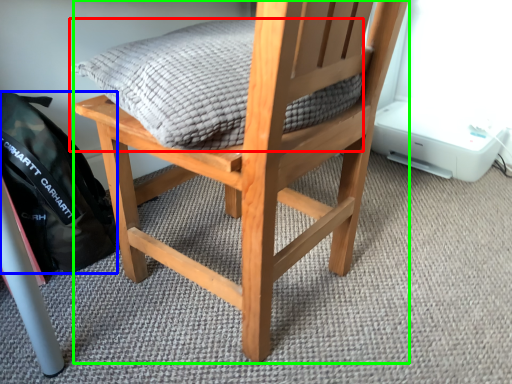
Question: Estimate the real-world distances between objects in this image. Which object is closer to pillow (highlighted by a red box), backpack (highlighted by a blue box) or chair (highlighted by a green box)?

Choices:
 (A) backpack
 (B) chair

Answer: (B)